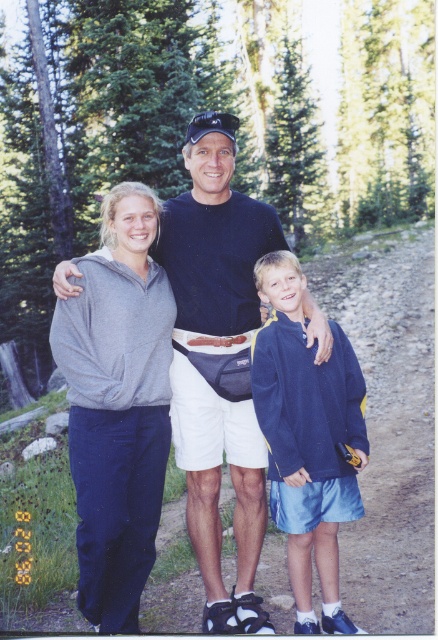
Which is in front, point (140, 314) or point (218, 188)?

Point (140, 314)

Find the location of a particular element. This screenshot has height=640, width=438. gray fleece sweatshirt at left is located at coordinates (117, 404).

Who is lower down, black cotton shirt at center or navy blue fleece at center?

navy blue fleece at center is lower down.

Does black cotton shirt at center lie behind navy blue fleece at center?

Yes, black cotton shirt at center is further from the viewer.

Who is more distant from viewer, (x=258, y=458) or (x=278, y=400)?

The point (x=258, y=458) is behind.

Locate an element on the screen. Image resolution: width=438 pixels, height=640 pixels. black cotton shirt at center is located at coordinates (215, 240).

In the scene shown: Measure the distance between point (82, 580) and camera.

Point (82, 580) is 4.37 meters from camera.

Who is more distant from viewer, (127, 536) or (279, 400)?

Point (127, 536)

Where is `gray fleece sweatshirt at left`? The image size is (438, 640). gray fleece sweatshirt at left is located at coordinates (117, 404).